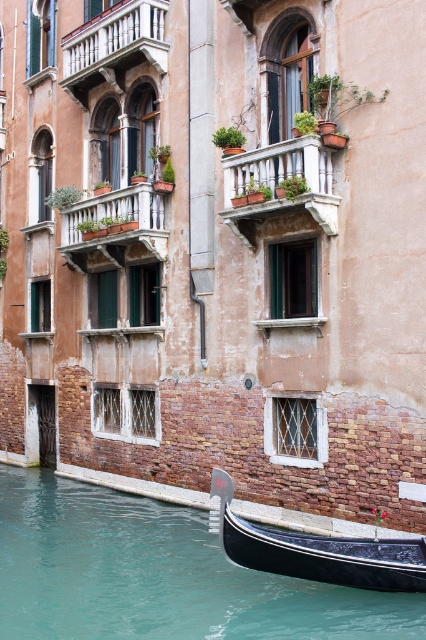
Is teal glossy water at lower left closer to camera compared to black polished wood gondola at lower right?

Yes, teal glossy water at lower left is closer to the viewer.

Is point (39, 529) in front of point (406, 540)?

That is False.

Identify the location of teal glossy water at lower left. The height and width of the screenshot is (640, 426). (158, 576).